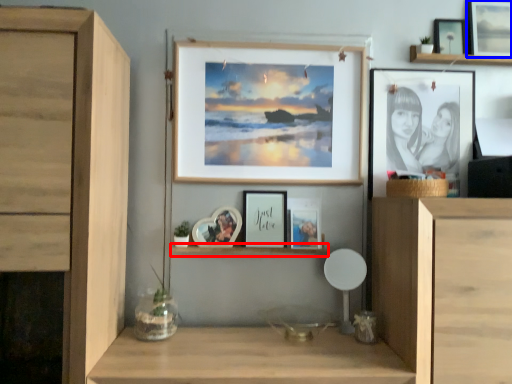
Question: Which point is closer to the camera, shelf (highlighted by a red box) or picture frame (highlighted by a blue box)?

Choices:
 (A) shelf
 (B) picture frame

Answer: (A)